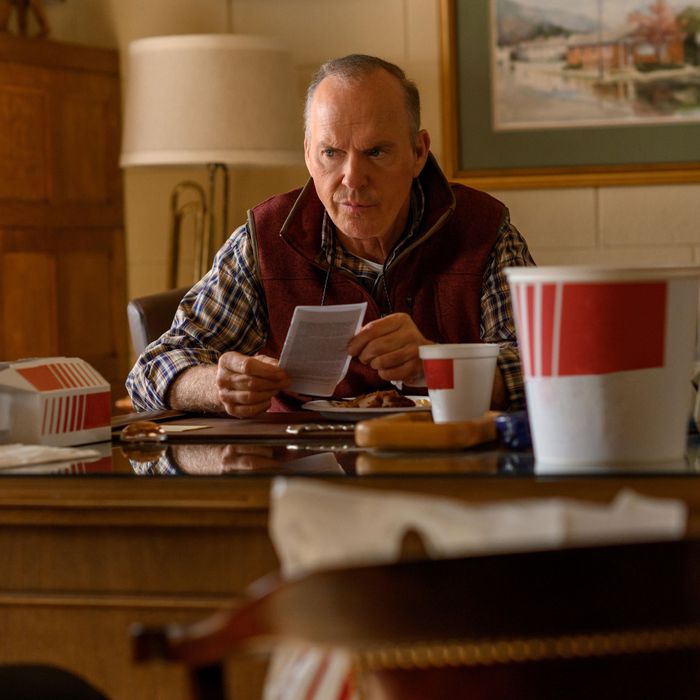
I want to click on back of brown wooden chair, bottom right corner, so click(626, 560), click(486, 596), click(363, 612).